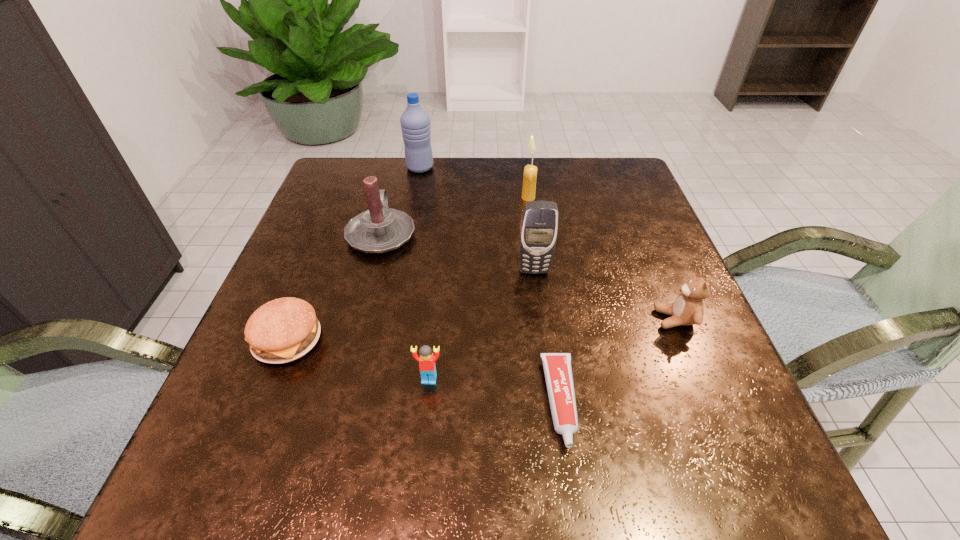
Locate an element on the screen. vacant space at the near edge of the desktop is located at coordinates (459, 475).

Image resolution: width=960 pixels, height=540 pixels. What are the coordinates of `vacant space at the left edge` in the screenshot? It's located at click(x=296, y=391).

In the image, there is a desktop. Find the location of `vacant space at the right edge`. vacant space at the right edge is located at coordinates (722, 396).

In the image, there is a desktop. Where is `vacant space at the near left corner`? vacant space at the near left corner is located at coordinates (290, 458).

In the image, there is a desktop. Where is `vacant space at the near right corner`? The width and height of the screenshot is (960, 540). vacant space at the near right corner is located at coordinates (658, 450).

Find the location of a particular element. The width and height of the screenshot is (960, 540). vacant area that lies between the farther candle and the second shortest object is located at coordinates (408, 269).

I want to click on free space between the fourth farthest object and the toothpaste, so click(x=547, y=336).

Where is `vacant space in between the fourth farthest object and the fifth tallest object`? vacant space in between the fourth farthest object and the fifth tallest object is located at coordinates (605, 295).

I want to click on empty location between the shortest object and the fifth tallest object, so click(618, 360).

Where is `unoccupied position between the Lego and the fifth nearest object`? The height and width of the screenshot is (540, 960). unoccupied position between the Lego and the fifth nearest object is located at coordinates (482, 325).